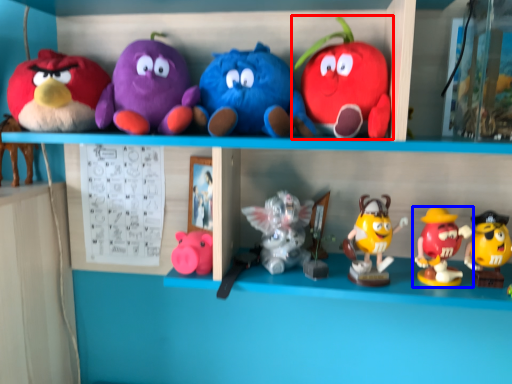
Question: Which of the following is the closest to the observer, toy (highlighted by a red box) or toy (highlighted by a blue box)?

Choices:
 (A) toy
 (B) toy

Answer: (A)